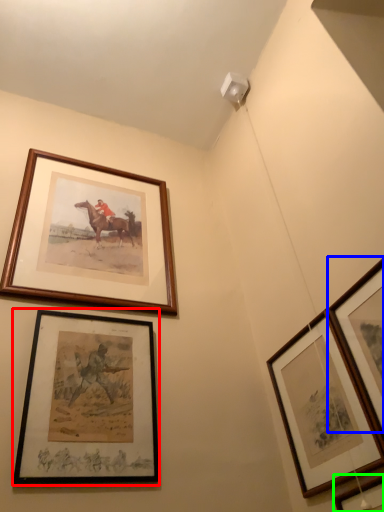
Question: Estimate the real-world distances between objects in this image. Which object is closer to picture frame (highlighted by a red box), picture frame (highlighted by a blue box) or picture frame (highlighted by a green box)?

Choices:
 (A) picture frame
 (B) picture frame

Answer: (B)